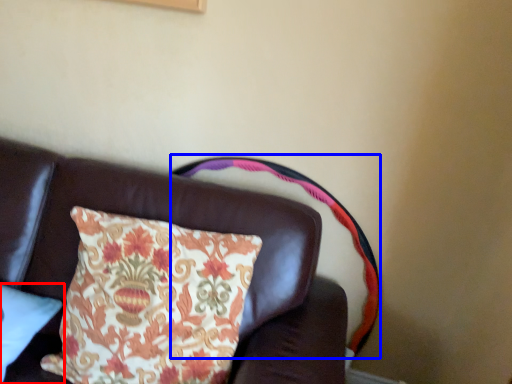
Question: Which of the following is the farthest to the observer, pillow (highlighted by a red box) or swivel chair (highlighted by a blue box)?

Choices:
 (A) pillow
 (B) swivel chair

Answer: (B)